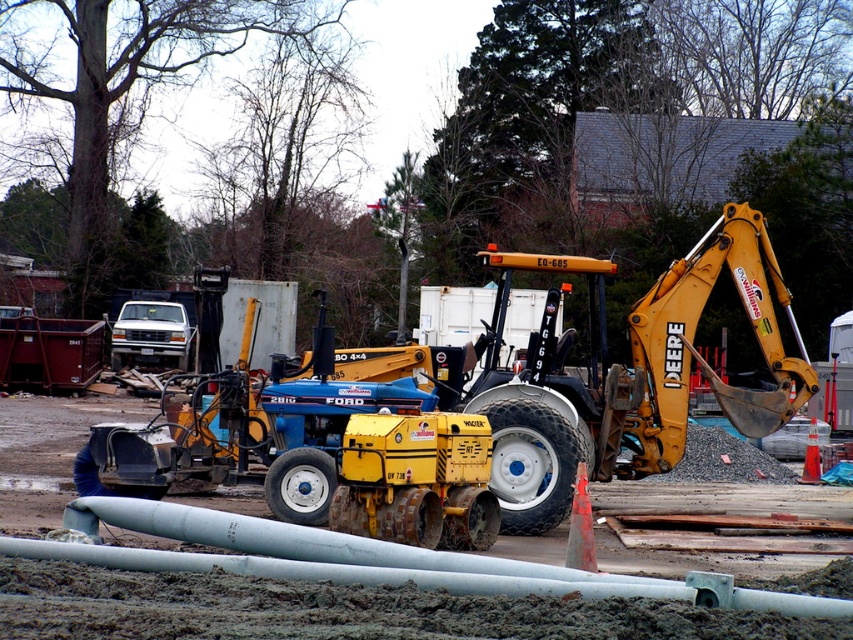
You are a construction worker who needs to move the yellow rubber tractor at center and the yellow metal excavator at center right through a narrow alleyway that is only 3 meters wide. Based on their widths, which machine will have more difficulty fitting through the alleyway?

The yellow rubber tractor at center has a greater width than the yellow metal excavactor at center right, so it will have more difficulty fitting through the 3 meter wide alleyway.

You are standing at the construction site and want to determine the relative positions of two points marked in the scene. Which point, point 1 at coordinates (299, 397) or point 2 at (656, 291), is closer to you?

Point 1 at coordinates (299, 397) is closer to the viewer than point 2 at (656, 291).

You are a construction worker standing at the edge of the site. You need to move a heavy box from the yellow rubber tractor at center to the yellow metal excavator at center right. Which direction should you move the box to place it closer to the excavator?

To move the box closer to the yellow metal excavator at center right, you should move it upward since the yellow rubber tractor at center is located below the yellow metal excavator at center right.